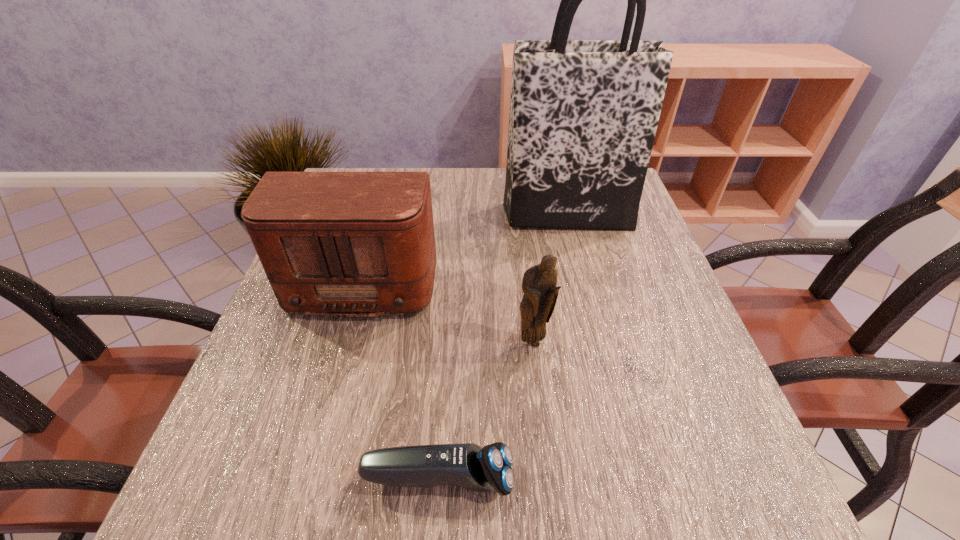
This screenshot has width=960, height=540. I want to click on free space between the radio receiver and the figurine, so click(x=449, y=310).

The width and height of the screenshot is (960, 540). What are the coordinates of `vacant area that lies between the radio receiver and the electric shaver` in the screenshot? It's located at (402, 379).

Where is `vacant area that lies between the shortest object and the shopping bag`? The image size is (960, 540). vacant area that lies between the shortest object and the shopping bag is located at coordinates (502, 347).

This screenshot has height=540, width=960. I want to click on vacant region between the electric shaver and the radio receiver, so click(402, 379).

The image size is (960, 540). Identify the location of free spot between the third nearest object and the tallest object. (466, 247).

This screenshot has height=540, width=960. I want to click on vacant area between the electric shaver and the radio receiver, so click(x=402, y=379).

At what (x,y) coordinates should I click in order to perform the action: click on free space that is in between the farthest object and the radio receiver. Please return your answer as a coordinate pair (x, y). Looking at the image, I should click on (466, 247).

You are a GUI agent. You are given a task and a screenshot of the screen. Output one action in this format:
    pyautogui.click(x=<x>, y=<y>)
    Task: Click on the vacant region between the second farthest object and the figurine
    This screenshot has height=540, width=960.
    Given the screenshot: What is the action you would take?
    pyautogui.click(x=449, y=310)

The width and height of the screenshot is (960, 540). Identify the location of empty space that is in between the farthest object and the shortest object. (502, 347).

Select which object is the closest to the shopping bag. Please provide its 2D coordinates. Your answer should be formatted as a tuple, i.e. [(x, y)], where the tuple contains the x and y coordinates of a point satisfying the conditions above.

[(348, 244)]